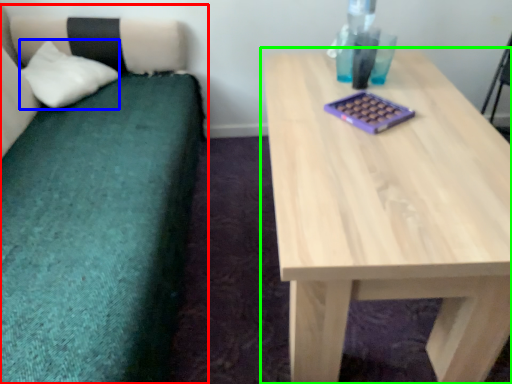
Question: Which object is the farthest from studio couch (highlighted by a red box)? Choose among these: pillow (highlighted by a blue box) or table (highlighted by a green box).

Choices:
 (A) pillow
 (B) table

Answer: (B)